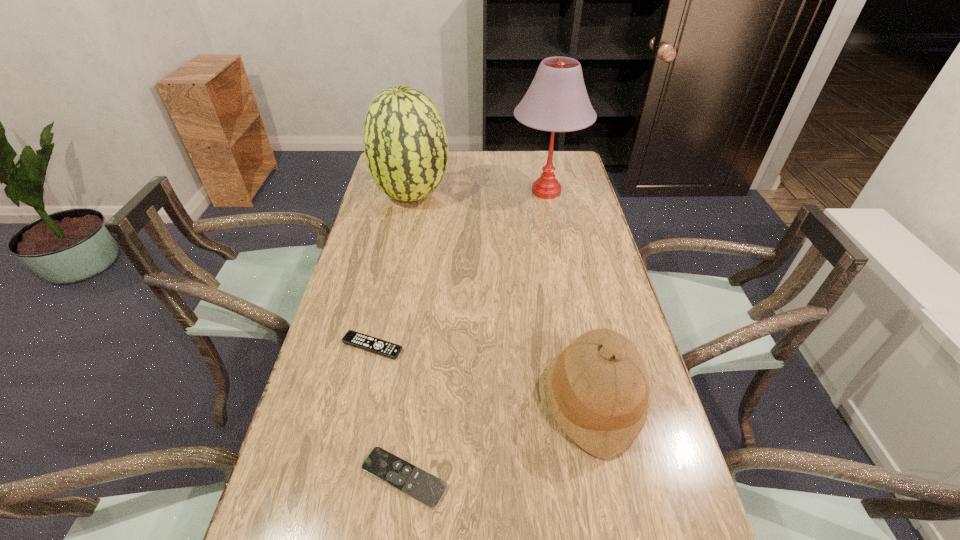
Identify which remote control is located as the second nearest to the second tallest object. Please provide its 2D coordinates. Your answer should be formatted as a tuple, i.e. [(x, y)], where the tuple contains the x and y coordinates of a point satisfying the conditions above.

[(416, 483)]

Find the location of a particular element. free region that satisfies the following two spatial constraints: 1. on the front side of the nearer remote control; 2. on the right side of the fourth tallest object is located at coordinates (343, 477).

Find the location of a particular element. free space that satisfies the following two spatial constraints: 1. on the front side of the farther remote control; 2. on the right side of the shortest object is located at coordinates (343, 477).

Where is `vacant space that satisfies the following two spatial constraints: 1. on the front-facing side of the hat; 2. on the front side of the nearer remote control`? vacant space that satisfies the following two spatial constraints: 1. on the front-facing side of the hat; 2. on the front side of the nearer remote control is located at coordinates (609, 477).